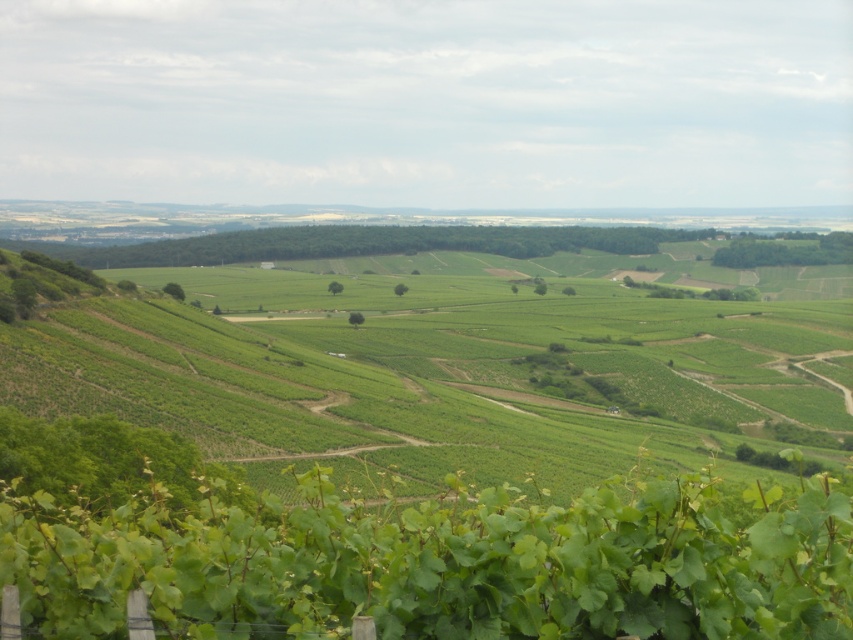
You are standing in the vineyard and see the green leafy vines at lower center and the green leafy vine at lower center. Which one is positioned to the left?

The green leafy vines at lower center are positioned to the left of the green leafy vine at lower center.

You are standing at the center of the vineyard and want to locate the green leafy vines at lower center. According to the coordinates provided, where exactly should you look?

The green leafy vines at lower center are located at coordinates point (444, 353).